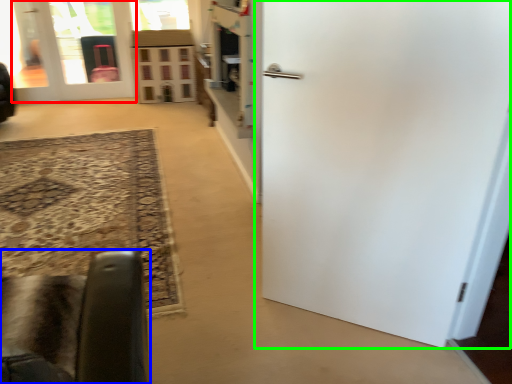
Question: Estimate the real-world distances between objects in this image. Which object is closer to door (highlighted by a red box), furniture (highlighted by a blue box) or door (highlighted by a green box)?

Choices:
 (A) furniture
 (B) door

Answer: (B)